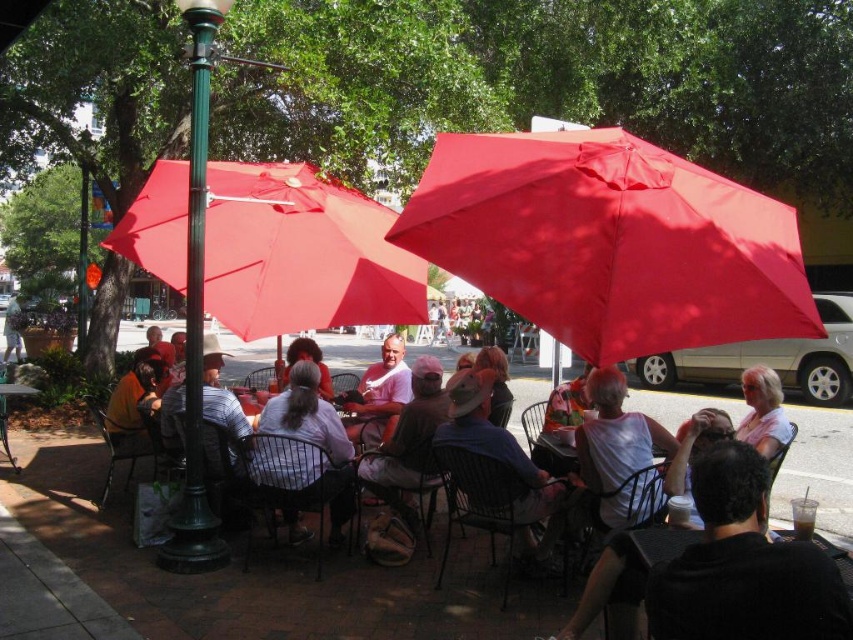
You are a photographer standing at the edge of the sidewalk. You want to take a photo of both the matte pink shirt at center and the matte white shirt at center without any obstructions. Which person should you move slightly backward to ensure both are visible?

The matte white shirt at center should be moved slightly backward because the matte pink shirt at center is currently in front of it, blocking part of the view.

From the picture: You are a photographer standing at the edge of the sidewalk. You want to take a photo of the white matte shirt at center and the white fabric umbrella at center. From your position, which object is positioned to the left side of the other?

The white matte shirt at center is to the left of the white fabric umbrella at center.

In the scene shown: You are a photographer trying to capture a clear shot of the white fabric umbrella at center without any obstructions. However, there is a white matte shirt at center in the scene. Based on their sizes, which object should you adjust your camera angle to focus on first to ensure the umbrella is visible?

The white matte shirt at center is larger in size than the white fabric umbrella at center. To ensure the umbrella is visible, you should adjust your camera angle to focus on the white fabric umbrella at center first, as it is smaller and might be partially obscured by the larger shirt.